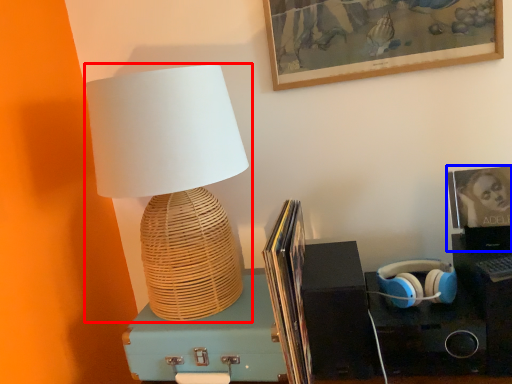
Question: Among these objects, which one is farthest to the camera, lamp (highlighted by a red box) or picture frame (highlighted by a blue box)?

Choices:
 (A) lamp
 (B) picture frame

Answer: (B)